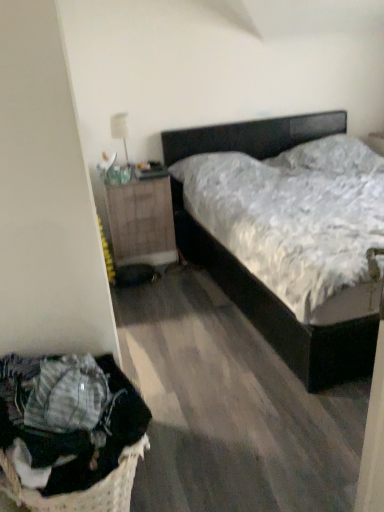
Question: Could woven fabric laundry basket at lower left be considered to be inside wooden nightstand at left?

Choices:
 (A) yes
 (B) no

Answer: (B)

Question: Does wooden nightstand at left have a greater width compared to woven fabric laundry basket at lower left?

Choices:
 (A) no
 (B) yes

Answer: (B)

Question: Is wooden nightstand at left not near woven fabric laundry basket at lower left?

Choices:
 (A) no
 (B) yes

Answer: (B)

Question: From the image's perspective, is wooden nightstand at left on top of woven fabric laundry basket at lower left?

Choices:
 (A) yes
 (B) no

Answer: (A)

Question: Does wooden nightstand at left touch woven fabric laundry basket at lower left?

Choices:
 (A) no
 (B) yes

Answer: (A)

Question: From the image's perspective, is woven fabric laundry basket at lower left positioned above or below black matte bed at center?

Choices:
 (A) below
 (B) above

Answer: (A)

Question: In the image, is woven fabric laundry basket at lower left positioned in front of or behind black matte bed at center?

Choices:
 (A) behind
 (B) front

Answer: (B)

Question: Does point (102, 394) appear closer or farther from the camera than point (322, 117)?

Choices:
 (A) closer
 (B) farther

Answer: (A)

Question: Would you say woven fabric laundry basket at lower left is inside or outside black matte bed at center?

Choices:
 (A) inside
 (B) outside

Answer: (B)

Question: Based on their positions, is woven fabric laundry basket at lower left located to the left or right of wooden nightstand at left?

Choices:
 (A) right
 (B) left

Answer: (A)

Question: Is woven fabric laundry basket at lower left wider or thinner than wooden nightstand at left?

Choices:
 (A) wide
 (B) thin

Answer: (B)

Question: From their relative heights in the image, would you say woven fabric laundry basket at lower left is taller or shorter than wooden nightstand at left?

Choices:
 (A) short
 (B) tall

Answer: (A)

Question: Is woven fabric laundry basket at lower left inside the boundaries of wooden nightstand at left, or outside?

Choices:
 (A) inside
 (B) outside

Answer: (B)

Question: From a real-world perspective, is black matte bed at center above or below woven fabric laundry basket at lower left?

Choices:
 (A) below
 (B) above

Answer: (B)

Question: Relative to woven fabric laundry basket at lower left, is black matte bed at center in front or behind?

Choices:
 (A) front
 (B) behind

Answer: (B)